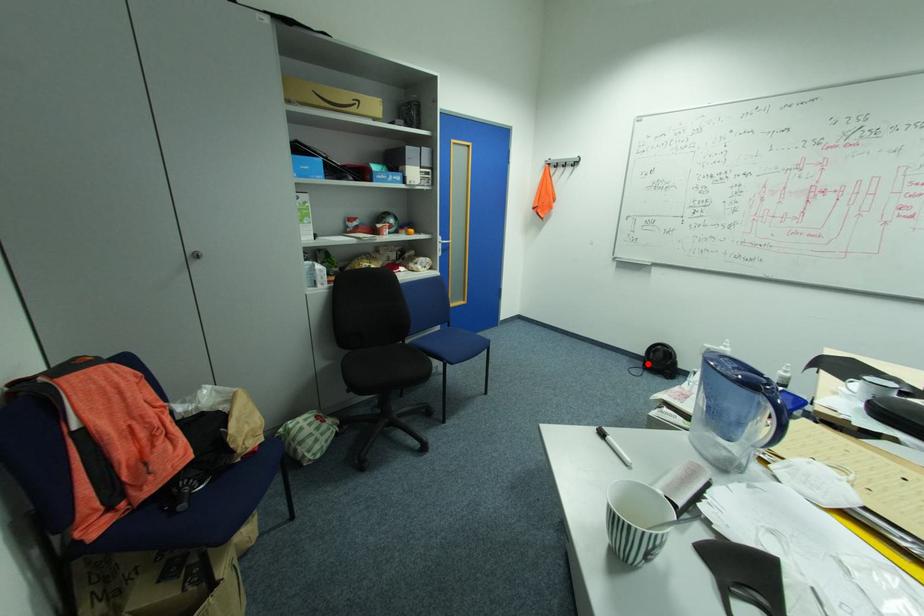
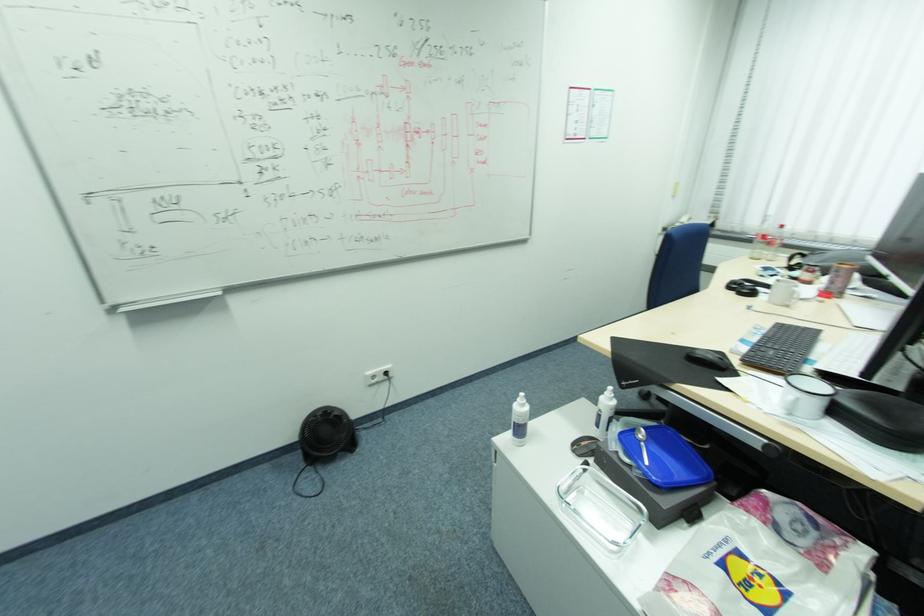
Question: I am providing you with two images of the same scene from different viewpoints. Image1 has a red point marked. In image2, the corresponding 3D location appears at what relative position? Reply with the corresponding letter.

Choices:
 (A) Closer
 (B) Farther

Answer: (B)